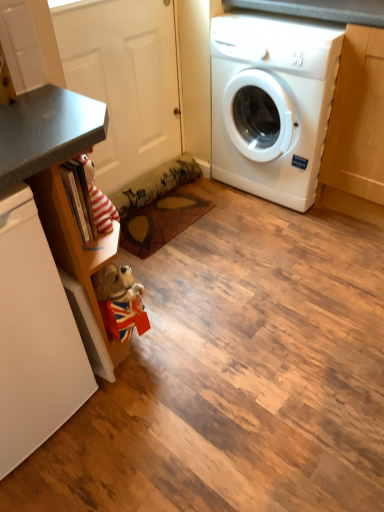
Question: Is white glossy washing machine at right to the left or to the right of white matte dishwasher at left in the image?

Choices:
 (A) right
 (B) left

Answer: (A)

Question: Is white glossy washing machine at right spatially inside white matte dishwasher at left, or outside of it?

Choices:
 (A) outside
 (B) inside

Answer: (A)

Question: Considering their positions, is white glossy washing machine at right located in front of or behind white matte dishwasher at left?

Choices:
 (A) behind
 (B) front

Answer: (A)

Question: Based on their positions, is white matte dishwasher at left located to the left or right of white glossy washing machine at right?

Choices:
 (A) left
 (B) right

Answer: (A)

Question: From a real-world perspective, relative to white glossy washing machine at right, is white matte dishwasher at left vertically above or below?

Choices:
 (A) above
 (B) below

Answer: (B)

Question: Is white matte dishwasher at left in front of or behind white glossy washing machine at right in the image?

Choices:
 (A) front
 (B) behind

Answer: (A)

Question: From the image's perspective, is white matte dishwasher at left located above or below white glossy washing machine at right?

Choices:
 (A) below
 (B) above

Answer: (A)